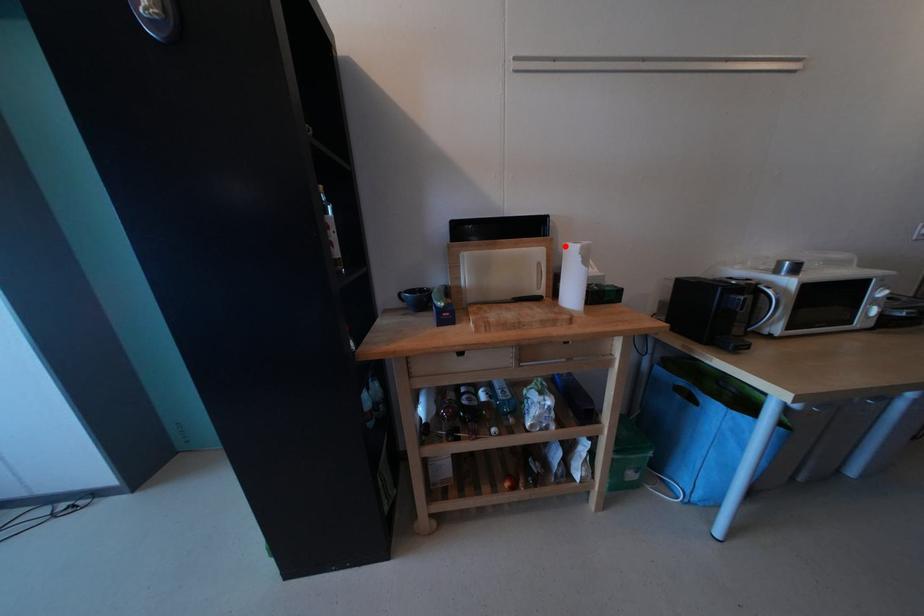
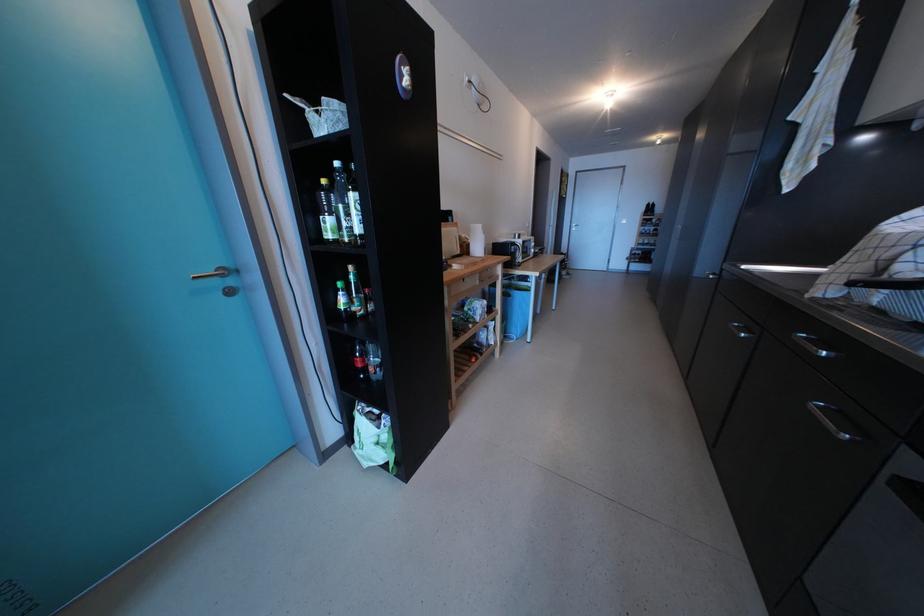
Find the pixel in the second image that matches the highlighted location in the first image.

(469, 230)